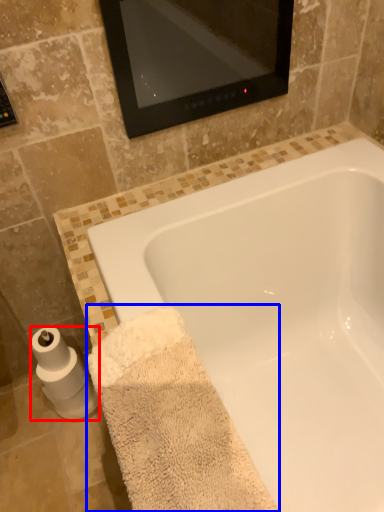
Question: Among these objects, which one is farthest to the camera, toilet paper (highlighted by a red box) or bath towel (highlighted by a blue box)?

Choices:
 (A) toilet paper
 (B) bath towel

Answer: (A)